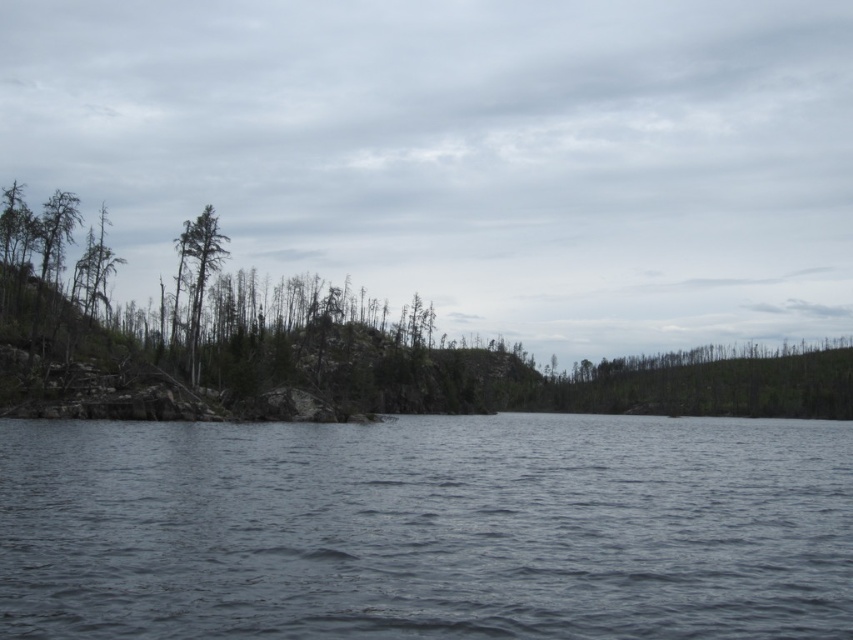
Question: Which object appears closest to the camera in this image?

Choices:
 (A) green matte trees at left
 (B) green matte tree at upper left

Answer: (A)

Question: Estimate the real-world distances between objects in this image. Which object is closer to the green matte tree at upper left?

Choices:
 (A) green matte trees at left
 (B) dark blue water at center

Answer: (B)

Question: Which point is farther from the camera taking this photo?

Choices:
 (A) (241, 634)
 (B) (196, 337)

Answer: (B)

Question: Can you confirm if dark blue water at center is positioned below green matte tree at upper left?

Choices:
 (A) no
 (B) yes

Answer: (B)

Question: Where is green matte trees at left located in relation to green matte tree at upper left in the image?

Choices:
 (A) below
 (B) above

Answer: (B)

Question: Can you confirm if dark blue water at center is positioned below green matte trees at left?

Choices:
 (A) no
 (B) yes

Answer: (B)